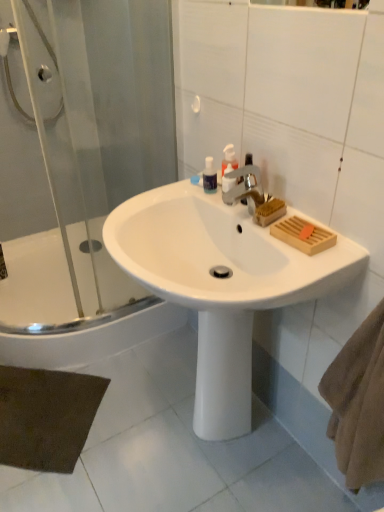
Question: Can you confirm if white glossy sink at center is positioned to the left of transparent glass shower door at left?

Choices:
 (A) no
 (B) yes

Answer: (A)

Question: Does white glossy sink at center have a greater width compared to transparent glass shower door at left?

Choices:
 (A) yes
 (B) no

Answer: (A)

Question: From the image's perspective, is white glossy sink at center beneath transparent glass shower door at left?

Choices:
 (A) yes
 (B) no

Answer: (A)

Question: Does white glossy sink at center lie behind transparent glass shower door at left?

Choices:
 (A) yes
 (B) no

Answer: (B)

Question: From the image's perspective, is white glossy sink at center on top of transparent glass shower door at left?

Choices:
 (A) no
 (B) yes

Answer: (A)

Question: From a real-world perspective, is white glossy bathtub at lower left positioned above or below brown felt bath mat at lower left?

Choices:
 (A) below
 (B) above

Answer: (B)

Question: Is white glossy bathtub at lower left situated inside brown felt bath mat at lower left or outside?

Choices:
 (A) outside
 (B) inside

Answer: (A)

Question: Is white glossy bathtub at lower left bigger or smaller than brown felt bath mat at lower left?

Choices:
 (A) big
 (B) small

Answer: (A)

Question: Does point (110, 322) appear closer or farther from the camera than point (89, 376)?

Choices:
 (A) closer
 (B) farther

Answer: (B)

Question: Is brown felt bath mat at lower left wider or thinner than translucent plastic soap dispenser at upper center?

Choices:
 (A) thin
 (B) wide

Answer: (B)

Question: From their relative heights in the image, would you say brown felt bath mat at lower left is taller or shorter than translucent plastic soap dispenser at upper center?

Choices:
 (A) tall
 (B) short

Answer: (B)

Question: Considering the positions of brown felt bath mat at lower left and translucent plastic soap dispenser at upper center in the image, is brown felt bath mat at lower left bigger or smaller than translucent plastic soap dispenser at upper center?

Choices:
 (A) small
 (B) big

Answer: (B)

Question: From a real-world perspective, relative to translucent plastic soap dispenser at upper center, is brown felt bath mat at lower left vertically above or below?

Choices:
 (A) below
 (B) above

Answer: (A)

Question: From the image's perspective, relative to transparent plastic mouthwash at upper center, is white glossy sink at center above or below?

Choices:
 (A) below
 (B) above

Answer: (A)

Question: In terms of width, does white glossy sink at center look wider or thinner when compared to transparent plastic mouthwash at upper center?

Choices:
 (A) wide
 (B) thin

Answer: (A)